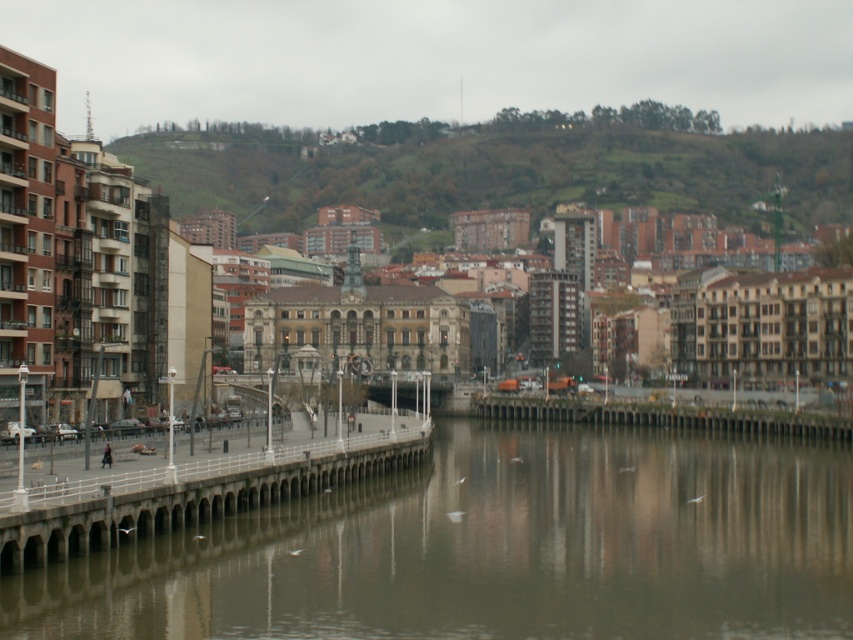
Is point (552, 166) behind point (799, 433)?

Yes, point (552, 166) is behind point (799, 433).

Is point (399, 163) in front of point (479, 400)?

No, (399, 163) is further to viewer.

This screenshot has width=853, height=640. In order to click on green grassy hillside at upper center in this screenshot , I will do click(494, 172).

You are a GUI agent. You are given a task and a screenshot of the screen. Output one action in this format:
    pyautogui.click(x=<x>, y=<y>)
    Task: Click on the green grassy hillside at upper center
    The height and width of the screenshot is (640, 853).
    Given the screenshot: What is the action you would take?
    pyautogui.click(x=494, y=172)

Can you confirm if smooth concrete river at center is wider than concrete dock at lower left?

Correct, the width of smooth concrete river at center exceeds that of concrete dock at lower left.

Who is positioned more to the right, smooth concrete river at center or concrete dock at lower left?

smooth concrete river at center

At what (x,y) coordinates should I click in order to perform the action: click on smooth concrete river at center. Please return your answer as a coordinate pair (x, y). The image size is (853, 640). Looking at the image, I should click on (495, 548).

Does point (427, 436) come farther from viewer compared to point (576, 413)?

No.

Between concrete dock at lower left and concrete bridge at center, which one has less height?

With less height is concrete bridge at center.

Identify the location of concrete dock at lower left. This screenshot has height=640, width=853. (189, 500).

Locate an element on the screen. This screenshot has height=640, width=853. concrete dock at lower left is located at coordinates (189, 500).